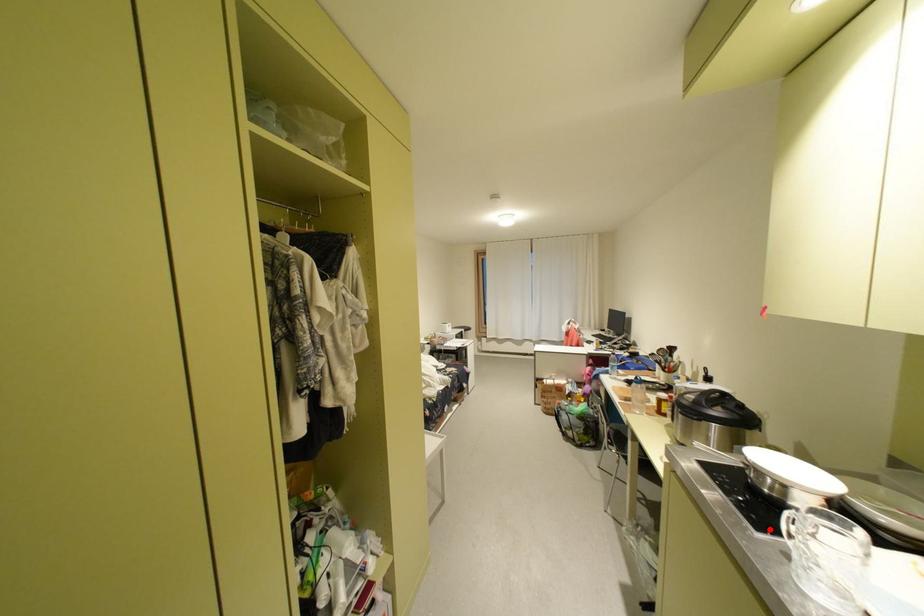
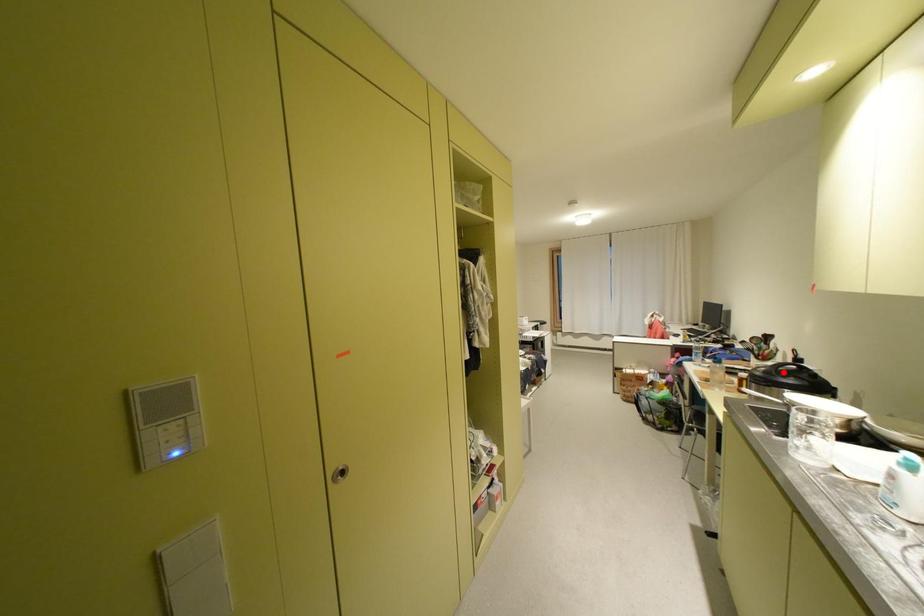
I am providing you with two images of the same scene from different viewpoints. A red point is marked on the first image and another point is marked on the second image. Is the marked point in image1 the same physical position as the marked point in image2?

No